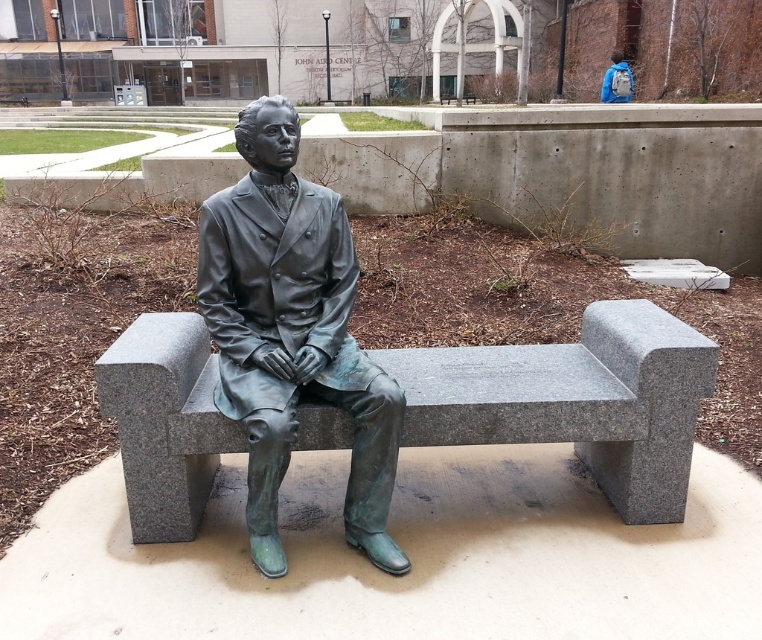
Based on the photo, is granite bench at center above bronze statue at center?

No, granite bench at center is not above bronze statue at center.

Can you confirm if granite bench at center is positioned to the left of bronze statue at center?

No, granite bench at center is not to the left of bronze statue at center.

Is point (311, 424) positioned behind point (267, 528)?

Yes, it is.

You are a GUI agent. You are given a task and a screenshot of the screen. Output one action in this format:
    pyautogui.click(x=<x>, y=<y>)
    Task: Click on the granite bench at center
    
    Given the screenshot: What is the action you would take?
    pyautogui.click(x=575, y=401)